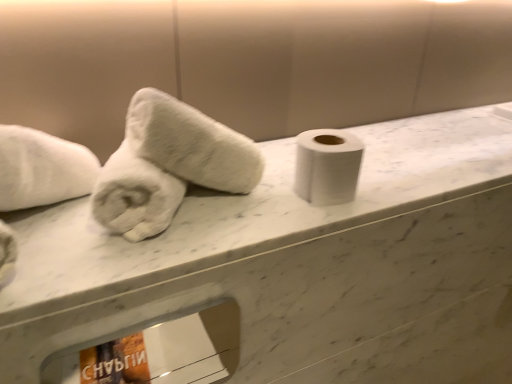
Find the location of a particular element. white marble counter at center is located at coordinates (298, 267).

What is the approximate height of white fluffy towel at left, which is counted as the 2th towel, starting from the right?

The height of white fluffy towel at left, which is counted as the 2th towel, starting from the right, is 9.75 centimeters.

The image size is (512, 384). What do you see at coordinates (135, 196) in the screenshot? I see `white fluffy towel at left, which is counted as the 2th towel, starting from the right` at bounding box center [135, 196].

What do you see at coordinates (327, 166) in the screenshot? I see `white matte toilet paper at center` at bounding box center [327, 166].

What do you see at coordinates (191, 144) in the screenshot? I see `white fluffy towel at left, positioned as the 2th towel in left-to-right order` at bounding box center [191, 144].

The height and width of the screenshot is (384, 512). I want to click on white marble counter at center, so [x=298, y=267].

From the image's perspective, which is above, white fluffy towel at left, the 1th towel in the right-to-left sequence, or white fluffy towel at left, which is counted as the 2th towel, starting from the right?

white fluffy towel at left, the 1th towel in the right-to-left sequence, appears higher in the image.

From a real-world perspective, is white fluffy towel at left, positioned as the 2th towel in left-to-right order, positioned over white fluffy towel at left, which is counted as the 2th towel, starting from the right, based on gravity?

Yes, from a real-world perspective, white fluffy towel at left, positioned as the 2th towel in left-to-right order, is over white fluffy towel at left, which is counted as the 2th towel, starting from the right

From the image's perspective, between white matte toilet paper at center and white marble counter at center, which one is located above?

white marble counter at center is shown above in the image.

Who is smaller, white matte toilet paper at center or white marble counter at center?

white matte toilet paper at center.

Is white matte toilet paper at center facing towards white marble counter at center?

No, white matte toilet paper at center is not aimed at white marble counter at center.

Is white matte toilet paper at center at the right side of white marble counter at center?

In fact, white matte toilet paper at center is to the left of white marble counter at center.

Looking at this image, is white marble counter at center positioned beyond the bounds of white fluffy towel at left, positioned as the 2th towel in left-to-right order?

white marble counter at center is positioned outside white fluffy towel at left, positioned as the 2th towel in left-to-right order.

Considering the sizes of objects white marble counter at center and white fluffy towel at left, the 1th towel in the right-to-left sequence, in the image provided, who is smaller, white marble counter at center or white fluffy towel at left, the 1th towel in the right-to-left sequence,?

white fluffy towel at left, the 1th towel in the right-to-left sequence.

From the image's perspective, is white marble counter at center above or below white fluffy towel at left, positioned as the 2th towel in left-to-right order?

white marble counter at center is below white fluffy towel at left, positioned as the 2th towel in left-to-right order.

Does white marble counter at center have a lesser height compared to white fluffy towel at left, positioned as the 2th towel in left-to-right order?

Correct, white marble counter at center is not as tall as white fluffy towel at left, positioned as the 2th towel in left-to-right order.

From a real-world perspective, does white fluffy towel at left, positioned as the 2th towel in left-to-right order, sit lower than white marble counter at center?

Incorrect, from a real-world perspective, white fluffy towel at left, positioned as the 2th towel in left-to-right order, is higher than white marble counter at center.

Considering the sizes of white fluffy towel at left, positioned as the 2th towel in left-to-right order, and white marble counter at center in the image, is white fluffy towel at left, positioned as the 2th towel in left-to-right order, taller or shorter than white marble counter at center?

white fluffy towel at left, positioned as the 2th towel in left-to-right order, is taller than white marble counter at center.

Considering the positions of point (228, 131) and point (486, 329), is point (228, 131) closer or farther from the camera than point (486, 329)?

Point (228, 131) appears to be closer to the viewer than point (486, 329).

Looking at this image, between white marble counter at center and white fluffy towel at left, which is counted as the 2th towel, starting from the right, which one has smaller width?

Thinner between the two is white fluffy towel at left, which is counted as the 2th towel, starting from the right.

How different are the orientations of white marble counter at center and white fluffy towel at left, which is counted as the 2th towel, starting from the right, in degrees?

The angular difference between white marble counter at center and white fluffy towel at left, which is counted as the 2th towel, starting from the right, is 35.5 degrees.

From the picture: Could you tell me if white marble counter at center is turned towards white fluffy towel at left, which is counted as the 2th towel, starting from the right?

No, white marble counter at center is not turned towards white fluffy towel at left, which is counted as the 2th towel, starting from the right.

Measure the distance from white marble counter at center to white fluffy towel at left, positioned as the first towel in left-to-right order.

The distance of white marble counter at center from white fluffy towel at left, positioned as the first towel in left-to-right order, is 14.84 inches.

From a real-world perspective, is white fluffy towel at left, positioned as the 2th towel in left-to-right order, on white matte toilet paper at center?

Yes, from a real-world perspective, white fluffy towel at left, positioned as the 2th towel in left-to-right order, is above white matte toilet paper at center.

Is point (159, 119) farther from viewer compared to point (311, 134)?

No, (159, 119) is in front of (311, 134).

From the image's perspective, who appears lower, white fluffy towel at left, the 1th towel in the right-to-left sequence, or white matte toilet paper at center?

white matte toilet paper at center, from the image's perspective.

Considering the relative positions of white fluffy towel at left, positioned as the 2th towel in left-to-right order, and white matte toilet paper at center in the image provided, is white fluffy towel at left, positioned as the 2th towel in left-to-right order, behind white matte toilet paper at center?

No, it is not.

Is white fluffy towel at left, which is counted as the 2th towel, starting from the right, facing towards white marble counter at center?

No, white fluffy towel at left, which is counted as the 2th towel, starting from the right, is not turned towards white marble counter at center.

Choose the correct answer: Is white fluffy towel at left, positioned as the first towel in left-to-right order, inside white marble counter at center or outside it?

white fluffy towel at left, positioned as the first towel in left-to-right order, cannot be found inside white marble counter at center.

How much distance is there between white fluffy towel at left, positioned as the first towel in left-to-right order, and white marble counter at center?

14.84 inches.

Is white fluffy towel at left, which is counted as the 2th towel, starting from the right, taller than white marble counter at center?

Indeed, white fluffy towel at left, which is counted as the 2th towel, starting from the right, has a greater height compared to white marble counter at center.

The image size is (512, 384). In order to click on towel above the white fluffy towel at left, positioned as the first towel in left-to-right order (from a real-world perspective) in this screenshot , I will do `click(191, 144)`.

The width and height of the screenshot is (512, 384). Identify the location of counter on the right of white matte toilet paper at center. (298, 267).

Estimate the real-world distances between objects in this image. Which object is further from white fluffy towel at left, the 1th towel in the right-to-left sequence, white matte toilet paper at center or white fluffy towel at left, which is counted as the 2th towel, starting from the right?

white matte toilet paper at center lies further to white fluffy towel at left, the 1th towel in the right-to-left sequence, than the other object.

Considering their positions, is white marble counter at center positioned further to white matte toilet paper at center than white fluffy towel at left, which is counted as the 2th towel, starting from the right?

white marble counter at center is further to white matte toilet paper at center.

When comparing their distances from white fluffy towel at left, the 1th towel in the right-to-left sequence, does white matte toilet paper at center or white marble counter at center seem closer?

Based on the image, white matte toilet paper at center appears to be nearer to white fluffy towel at left, the 1th towel in the right-to-left sequence.

Looking at the image, which one is located closer to white matte toilet paper at center, white fluffy towel at left, positioned as the 2th towel in left-to-right order, or white marble counter at center?

white fluffy towel at left, positioned as the 2th towel in left-to-right order, is positioned closer to the anchor white matte toilet paper at center.

From the image, which object appears to be farther from white matte toilet paper at center, white fluffy towel at left, which is counted as the 2th towel, starting from the right, or white fluffy towel at left, positioned as the 2th towel in left-to-right order?

Based on the image, white fluffy towel at left, which is counted as the 2th towel, starting from the right, appears to be further to white matte toilet paper at center.

When comparing their distances from white fluffy towel at left, positioned as the first towel in left-to-right order, does white fluffy towel at left, the 1th towel in the right-to-left sequence, or white marble counter at center seem further?

Based on the image, white marble counter at center appears to be further to white fluffy towel at left, positioned as the first towel in left-to-right order.

Estimate the real-world distances between objects in this image. Which object is closer to white fluffy towel at left, positioned as the first towel in left-to-right order, white matte toilet paper at center or white marble counter at center?

Based on the image, white matte toilet paper at center appears to be nearer to white fluffy towel at left, positioned as the first towel in left-to-right order.

When comparing their distances from white marble counter at center, does white matte toilet paper at center or white fluffy towel at left, positioned as the 2th towel in left-to-right order, seem closer?

white matte toilet paper at center is closer to white marble counter at center.

Where is `toilet paper between white fluffy towel at left, which is counted as the 2th towel, starting from the right, and white marble counter at center`? The height and width of the screenshot is (384, 512). toilet paper between white fluffy towel at left, which is counted as the 2th towel, starting from the right, and white marble counter at center is located at coordinates (327, 166).

Image resolution: width=512 pixels, height=384 pixels. Find the location of `towel situated between white fluffy towel at left, positioned as the first towel in left-to-right order, and white matte toilet paper at center from left to right`. towel situated between white fluffy towel at left, positioned as the first towel in left-to-right order, and white matte toilet paper at center from left to right is located at coordinates (191, 144).

This screenshot has width=512, height=384. In order to click on towel between white fluffy towel at left, positioned as the first towel in left-to-right order, and white marble counter at center, in the horizontal direction in this screenshot , I will do `click(191, 144)`.

You are a GUI agent. You are given a task and a screenshot of the screen. Output one action in this format:
    pyautogui.click(x=<x>, y=<y>)
    Task: Click on the toilet paper between white fluffy towel at left, the 1th towel in the right-to-left sequence, and white marble counter at center from left to right
    The image size is (512, 384).
    Given the screenshot: What is the action you would take?
    pyautogui.click(x=327, y=166)